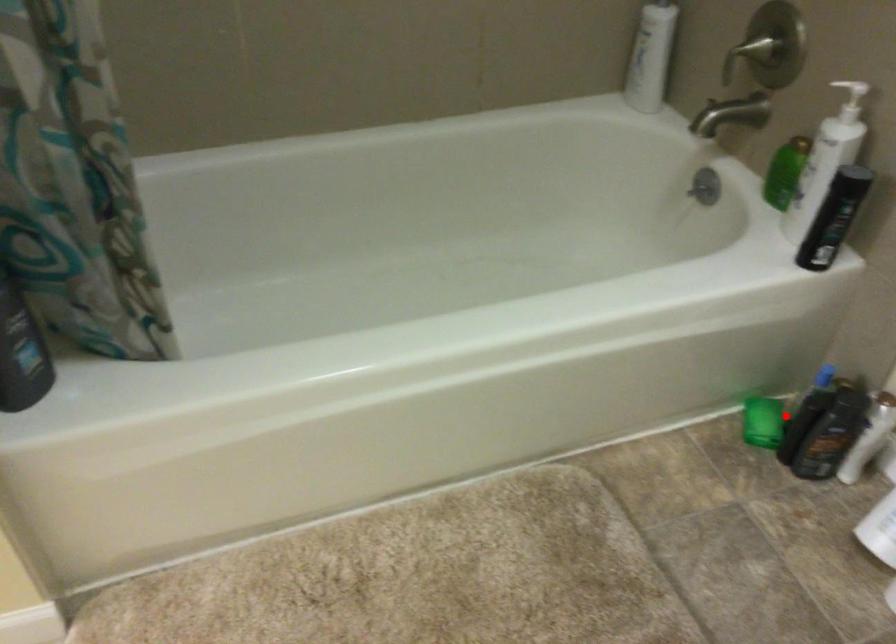
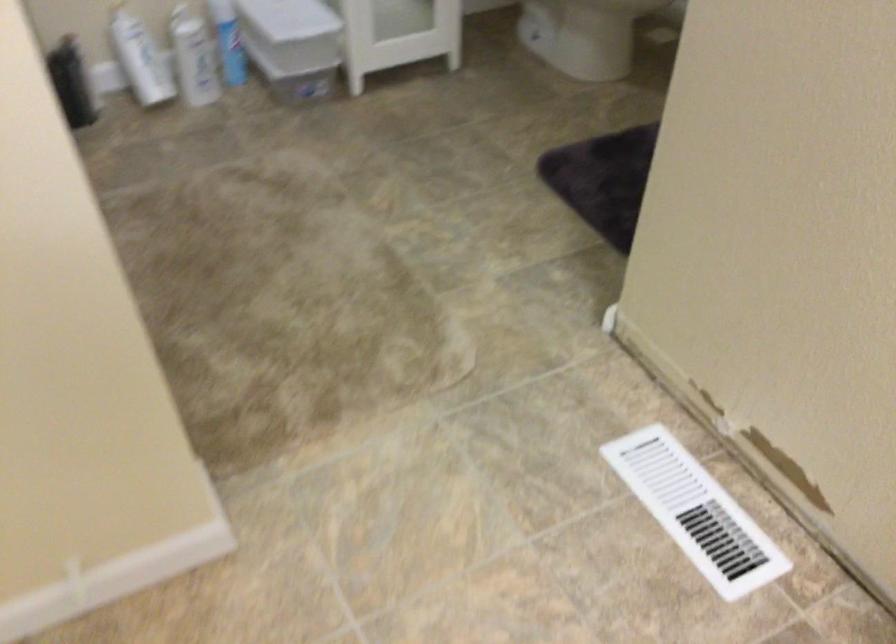
Where in the second image is the point corresponding to the highlighted location from the first image?

(72, 82)